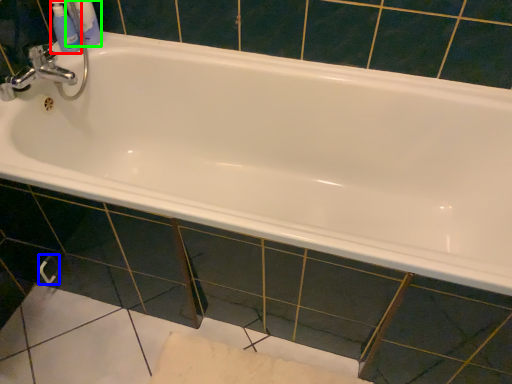
Question: Which object is the closest to the mouthwash (highlighted by a red box)? Choose among these: towel bar (highlighted by a blue box) or toiletry (highlighted by a green box).

Choices:
 (A) towel bar
 (B) toiletry

Answer: (B)